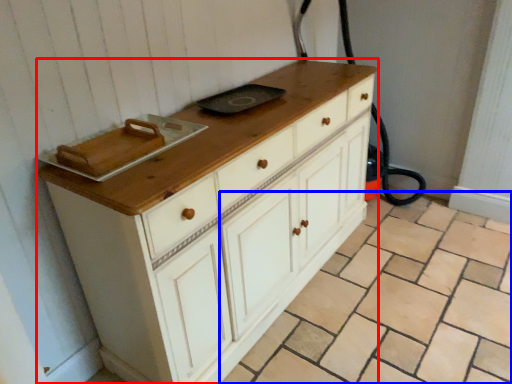
Question: Which point is closer to the camera, chest of drawers (highlighted by a red box) or tile (highlighted by a blue box)?

Choices:
 (A) chest of drawers
 (B) tile

Answer: (B)